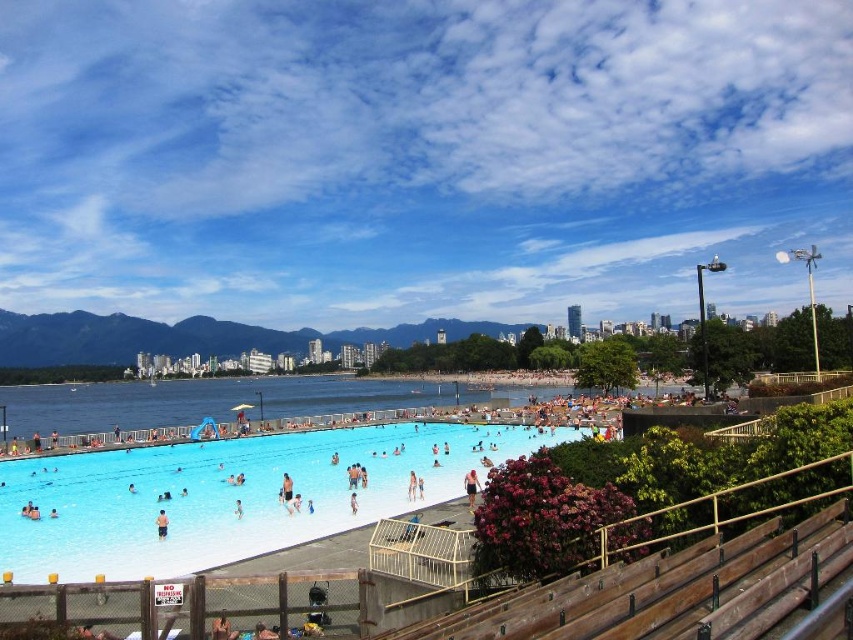
Question: Among these points, which one is nearest to the camera?

Choices:
 (A) (270, 493)
 (B) (160, 509)
 (C) (469, 508)

Answer: (C)

Question: Is clear plastic pool at lower center to the right of white cotton shorts at center from the viewer's perspective?

Choices:
 (A) yes
 (B) no

Answer: (B)

Question: Which point is farther to the camera?

Choices:
 (A) (270, 524)
 (B) (474, 486)

Answer: (B)

Question: Can you confirm if clear plastic pool at lower center is positioned to the left of light blue fabric swim trunks at center?

Choices:
 (A) yes
 (B) no

Answer: (B)

Question: Which of the following is the closest to the observer?

Choices:
 (A) (157, 536)
 (B) (225, 483)
 (C) (468, 499)

Answer: (A)

Question: Can you confirm if clear plastic pool at lower center is positioned to the left of light blue fabric swim trunks at center?

Choices:
 (A) yes
 (B) no

Answer: (B)